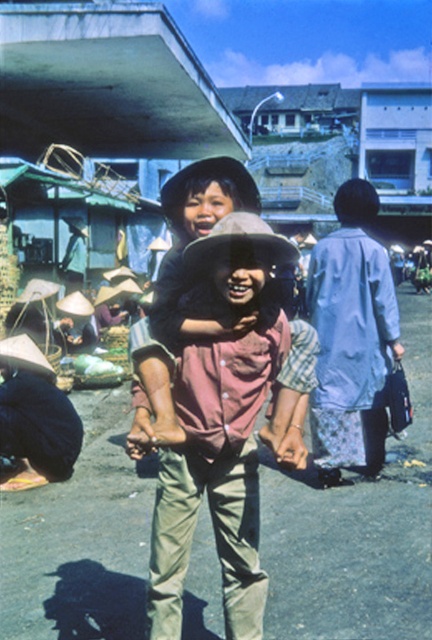
Based on the photo, does pink fabric dress at center appear on the right side of smooth concrete overpass at upper left?

Yes, pink fabric dress at center is to the right of smooth concrete overpass at upper left.

Is point (238, 554) less distant than point (212, 86)?

That is True.

Where is `pink fabric dress at center`? The height and width of the screenshot is (640, 432). pink fabric dress at center is located at coordinates (212, 420).

How distant is pink fabric dress at center from pink fabric at center?

They are 17.54 inches apart.

In the scene shown: Between pink fabric dress at center and pink fabric at center, which one has less height?

pink fabric at center

Locate an element on the screen. The image size is (432, 640). pink fabric dress at center is located at coordinates (212, 420).

You are a GUI agent. You are given a task and a screenshot of the screen. Output one action in this format:
    pyautogui.click(x=<x>, y=<y>)
    Task: Click on the pink fabric dress at center
    The height and width of the screenshot is (640, 432).
    Given the screenshot: What is the action you would take?
    pyautogui.click(x=212, y=420)

Does smooth concrete overpass at upper left have a lesser width compared to pink fabric at center?

No.

Who is higher up, smooth concrete overpass at upper left or pink fabric at center?

smooth concrete overpass at upper left is above.

Between point (95, 58) and point (235, 170), which one is positioned in front?

Point (235, 170) is in front.

You are a GUI agent. You are given a task and a screenshot of the screen. Output one action in this format:
    pyautogui.click(x=<x>, y=<y>)
    Task: Click on the smooth concrete overpass at upper left
    
    Given the screenshot: What is the action you would take?
    pyautogui.click(x=107, y=84)